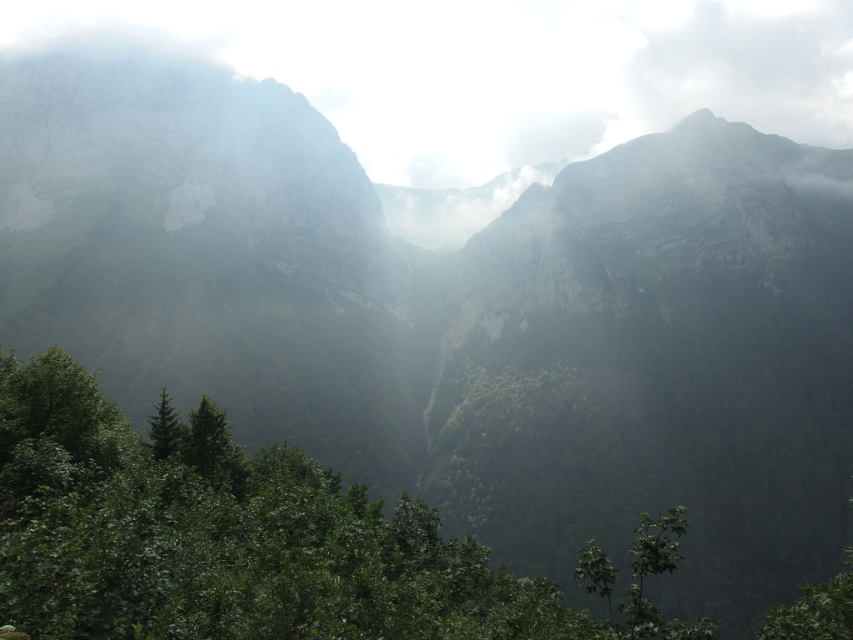
Question: Estimate the real-world distances between objects in this image. Which object is farther from the green matte tree at center?

Choices:
 (A) green leafy tree at center
 (B) green leafy tree at lower center

Answer: (A)

Question: Is green leafy tree at center bigger than green leafy tree at lower center?

Choices:
 (A) yes
 (B) no

Answer: (A)

Question: Estimate the real-world distances between objects in this image. Which object is closer to the green leafy tree at center?

Choices:
 (A) green leafy tree at lower center
 (B) green matte tree at center

Answer: (A)

Question: Estimate the real-world distances between objects in this image. Which object is farther from the green matte tree at center?

Choices:
 (A) green leafy tree at center
 (B) green leafy tree at lower center

Answer: (A)

Question: From the image, what is the correct spatial relationship of green leafy tree at center in relation to green leafy tree at lower center?

Choices:
 (A) above
 (B) below

Answer: (B)

Question: Is green leafy tree at lower center below green matte tree at center?

Choices:
 (A) yes
 (B) no

Answer: (B)